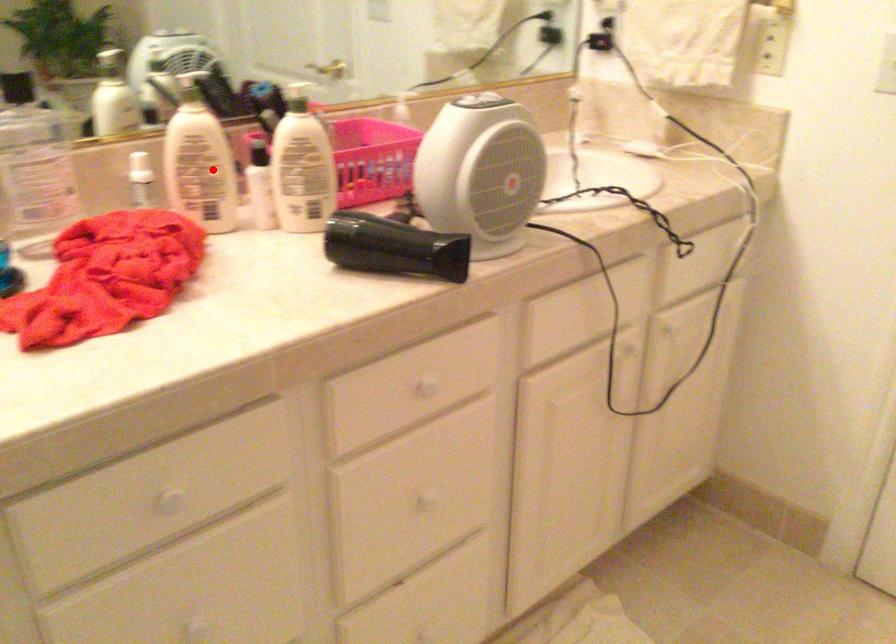
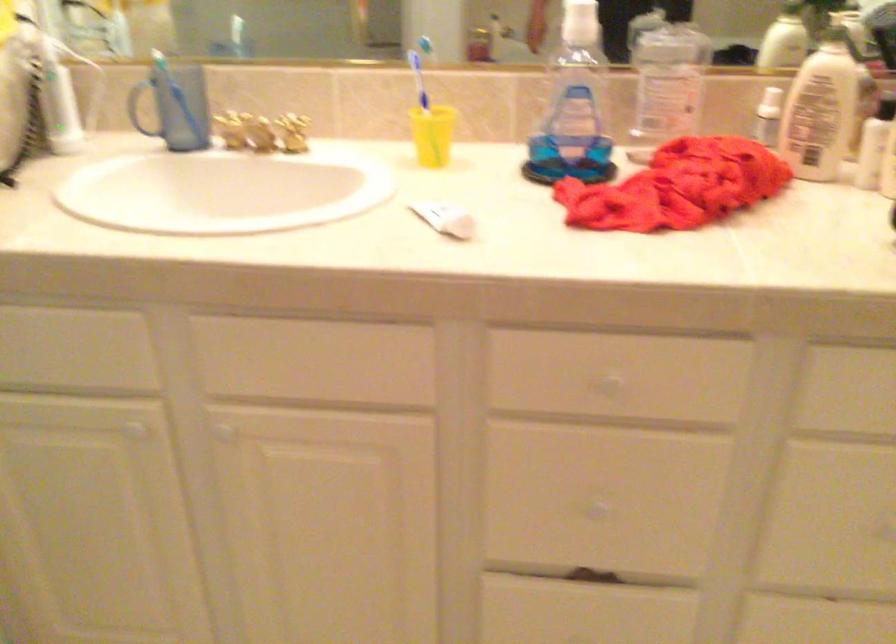
Locate, in the second image, the point that corresponds to the highlighted location in the first image.

(821, 109)